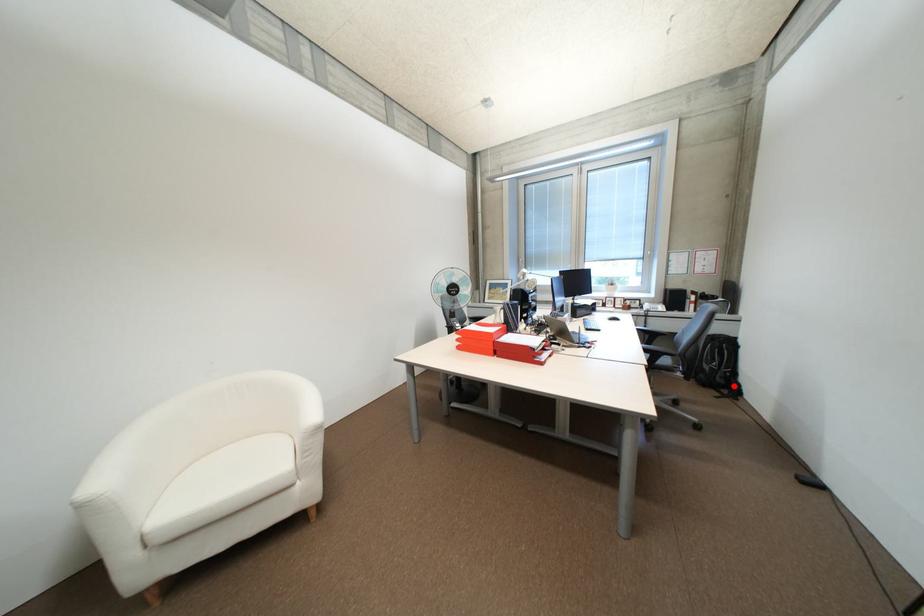
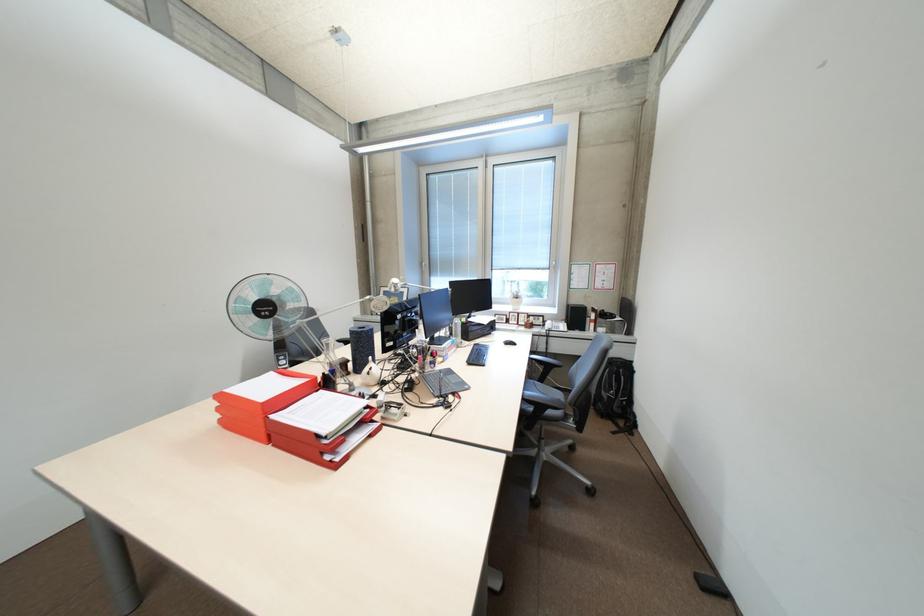
In the second image, find the point that corresponds to the highlighted location in the first image.

(630, 416)